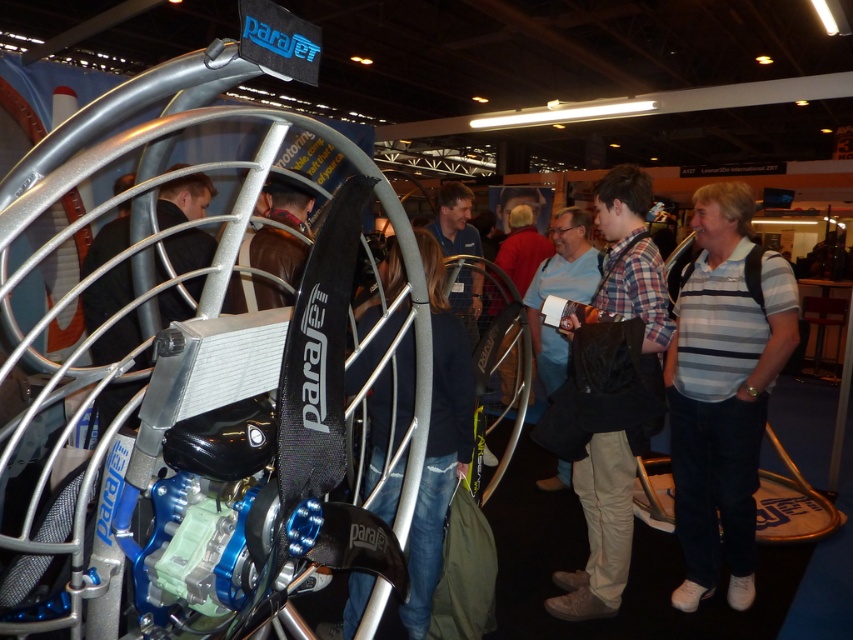
Based on the photo, you are organizing a photo shoot and need to arrange two models wearing the white striped shirt at right and the plaid fabric shirt at center. Which model should stand closer to the camera to ensure their shirt appears smaller in the photo?

The white striped shirt at right should be placed closer to the camera because its actual width is smaller than the plaid fabric shirt at center. This way, when positioned nearer, it will appear proportionally similar in size to the plaid fabric shirt at center in the photo.

You are standing at the entrance of the exhibition hall and see two people wearing a white striped shirt at right and dark blue denim jeans at center. Which person is standing closer to the ceiling?

The white striped shirt at right is taller than dark blue denim jeans at center, so the person wearing the white striped shirt at right is closer to the ceiling.